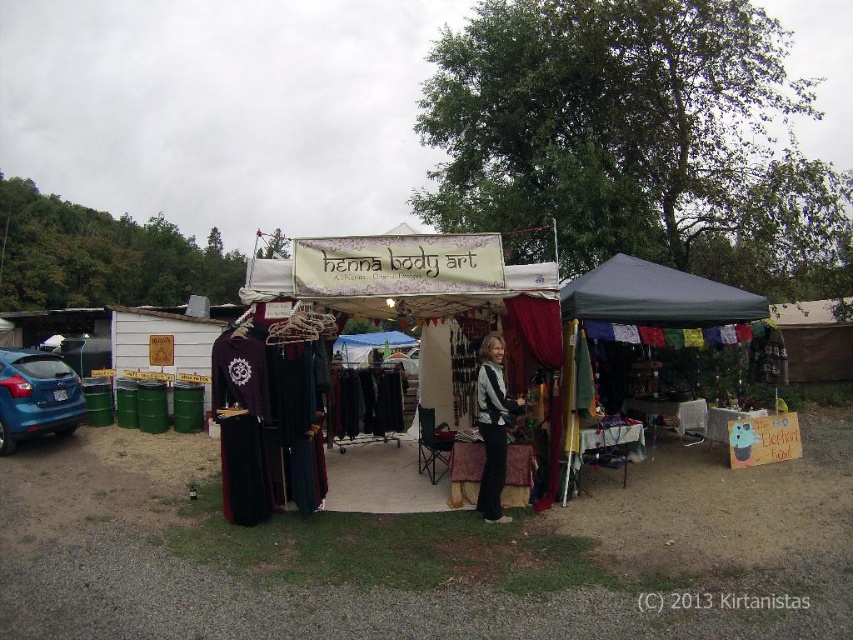
Question: Which object is closer to the camera taking this photo?

Choices:
 (A) black velvet vest at center
 (B) blue matte car at left
 (C) dark gray fabric canopy at center

Answer: (A)

Question: Does dark gray fabric tent at center have a larger size compared to dark gray fabric canopy at center?

Choices:
 (A) no
 (B) yes

Answer: (B)

Question: Does dark gray fabric canopy at center have a larger size compared to black velvet vest at center?

Choices:
 (A) no
 (B) yes

Answer: (B)

Question: Which of these objects is positioned farthest from the black velvet vest at center?

Choices:
 (A) blue matte car at left
 (B) dark gray fabric canopy at center
 (C) dark gray fabric tent at center
 (D) textured fabric stall at center

Answer: (A)

Question: Which object appears farthest from the camera in this image?

Choices:
 (A) blue matte car at left
 (B) dark gray fabric canopy at center
 (C) dark gray fabric tent at center
 (D) black velvet vest at center

Answer: (A)

Question: Is dark gray fabric tent at center closer to the viewer compared to blue matte car at left?

Choices:
 (A) yes
 (B) no

Answer: (A)